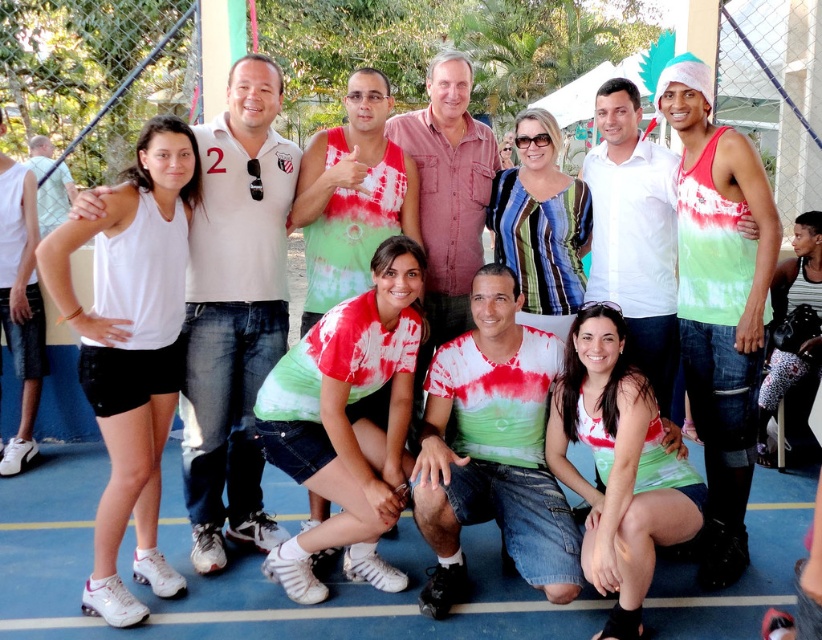
Between matte tie-dye shirt at lower center and light blue mesh tank top at left, which one is positioned higher?

light blue mesh tank top at left

Is matte tie-dye shirt at lower center above light blue mesh tank top at left?

No, matte tie-dye shirt at lower center is not above light blue mesh tank top at left.

Locate an element on the screen. matte tie-dye shirt at lower center is located at coordinates (617, 465).

Where is `matte tie-dye shirt at lower center`? This screenshot has width=822, height=640. matte tie-dye shirt at lower center is located at coordinates (617, 465).

Does white cotton polo shirt at left have a greater height compared to white matte tank top at left?

Yes.

Looking at this image, can you confirm if white cotton polo shirt at left is positioned above white matte tank top at left?

Indeed, white cotton polo shirt at left is positioned over white matte tank top at left.

Describe the element at coordinates (234, 308) in the screenshot. Image resolution: width=822 pixels, height=640 pixels. I see `white cotton polo shirt at left` at that location.

The image size is (822, 640). Find the location of `white cotton polo shirt at left`. white cotton polo shirt at left is located at coordinates (234, 308).

Measure the distance from white matte tank top at left to red tie-dye tank top at center.

white matte tank top at left and red tie-dye tank top at center are 8.54 feet apart from each other.

Does white matte tank top at left have a smaller size compared to red tie-dye tank top at center?

Indeed, white matte tank top at left has a smaller size compared to red tie-dye tank top at center.

Is point (162, 378) farther from viewer compared to point (700, 104)?

That is False.

Identify the location of white matte tank top at left. The height and width of the screenshot is (640, 822). pyautogui.click(x=132, y=349).